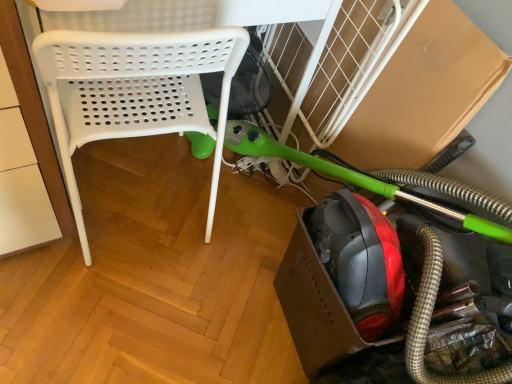
Question: Is green rubber garden hose at lower right positioned in front of white plastic chair at left?

Choices:
 (A) yes
 (B) no

Answer: (A)

Question: Is green rubber garden hose at lower right behind white plastic chair at left?

Choices:
 (A) yes
 (B) no

Answer: (B)

Question: Can you confirm if green rubber garden hose at lower right is taller than white plastic chair at left?

Choices:
 (A) yes
 (B) no

Answer: (B)

Question: Does green rubber garden hose at lower right have a greater width compared to white plastic chair at left?

Choices:
 (A) no
 (B) yes

Answer: (A)

Question: Can you confirm if green rubber garden hose at lower right is shorter than white plastic chair at left?

Choices:
 (A) no
 (B) yes

Answer: (B)

Question: Is green rubber garden hose at lower right aimed at white plastic chair at left?

Choices:
 (A) yes
 (B) no

Answer: (B)

Question: From the image's perspective, does white plastic chair at left appear higher than green rubber garden hose at lower right?

Choices:
 (A) yes
 (B) no

Answer: (A)

Question: From a real-world perspective, is white plastic chair at left positioned under green rubber garden hose at lower right based on gravity?

Choices:
 (A) no
 (B) yes

Answer: (A)

Question: Considering the relative positions of white plastic chair at left and green rubber garden hose at lower right in the image provided, is white plastic chair at left to the left of green rubber garden hose at lower right from the viewer's perspective?

Choices:
 (A) no
 (B) yes

Answer: (B)

Question: Considering the relative sizes of white plastic chair at left and green rubber garden hose at lower right in the image provided, is white plastic chair at left shorter than green rubber garden hose at lower right?

Choices:
 (A) yes
 (B) no

Answer: (B)

Question: Is white plastic chair at left placed right next to green rubber garden hose at lower right?

Choices:
 (A) no
 (B) yes

Answer: (A)

Question: Can you confirm if white plastic chair at left is bigger than green rubber garden hose at lower right?

Choices:
 (A) yes
 (B) no

Answer: (A)

Question: From a real-world perspective, is green rubber garden hose at lower right positioned above or below white plastic chair at left?

Choices:
 (A) above
 (B) below

Answer: (B)